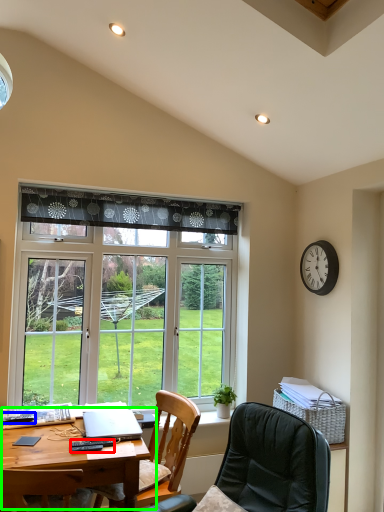
Question: Which object is positioned farthest from remote control (highlighted by a red box)? Select from remote control (highlighted by a blue box) and desk (highlighted by a green box).

Choices:
 (A) remote control
 (B) desk

Answer: (A)